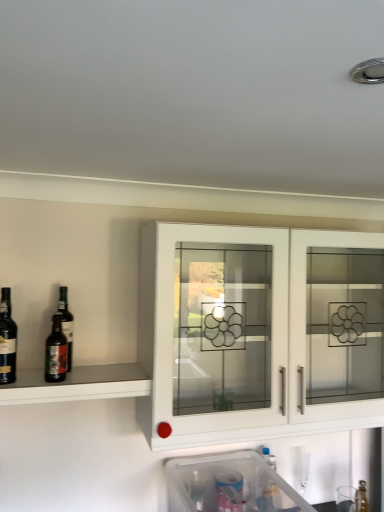
You are a GUI agent. You are given a task and a screenshot of the screen. Output one action in this format:
    pyautogui.click(x=<x>, y=<y>)
    Task: Click on the vacant space behind dark brown glass bottle at left, arranged as the first wine when viewed from the right
    Image resolution: width=384 pixels, height=512 pixels.
    Given the screenshot: What is the action you would take?
    pyautogui.click(x=71, y=371)